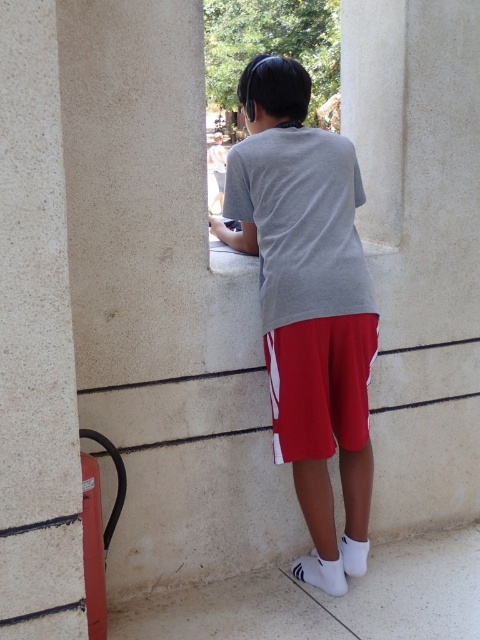
Question: Considering the real-world distances, which object is closest to the gray matte t-shirt at center?

Choices:
 (A) white textured pillar at left
 (B) white smooth pillar at center

Answer: (B)

Question: Does white smooth pillar at center come behind white textured pillar at left?

Choices:
 (A) no
 (B) yes

Answer: (B)

Question: Does white smooth pillar at center appear over gray matte t-shirt at center?

Choices:
 (A) yes
 (B) no

Answer: (A)

Question: Can you confirm if white smooth pillar at center is positioned below white textured pillar at left?

Choices:
 (A) yes
 (B) no

Answer: (B)

Question: Which point appears closest to the camera in this image?

Choices:
 (A) (376, 132)
 (B) (16, 564)
 (C) (337, 349)
 (D) (265, 218)

Answer: (B)

Question: Which of the following is the farthest from the observer?

Choices:
 (A) (373, 342)
 (B) (392, 86)
 (C) (24, 467)
 (D) (316, 358)

Answer: (B)